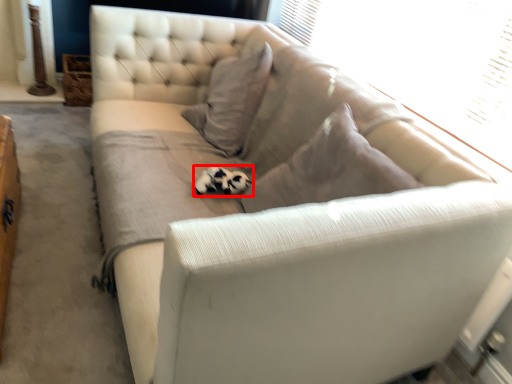
Question: Observing the image, what is the correct spatial positioning of animal (annotated by the red box) in reference to window screen?

Choices:
 (A) left
 (B) right

Answer: (A)